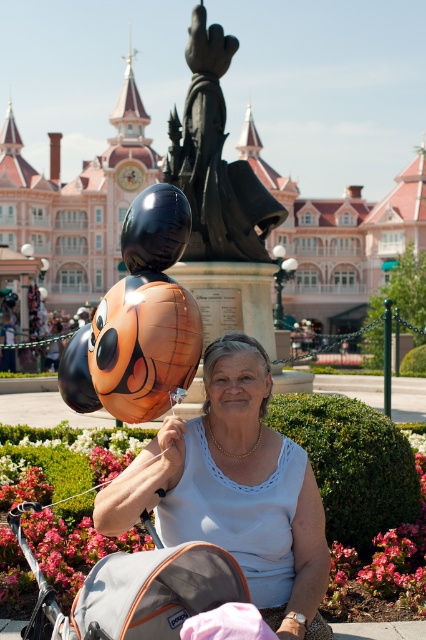
Question: Which object is closer to the camera taking this photo?

Choices:
 (A) black polished statue at center
 (B) white fabric shirt at center

Answer: (B)

Question: Which is farther from the gray fabric baby carriage at lower center?

Choices:
 (A) black polished statue at center
 (B) white fabric shirt at center

Answer: (A)

Question: Does white fabric shirt at center have a lesser width compared to black polished statue at center?

Choices:
 (A) yes
 (B) no

Answer: (B)

Question: Does white fabric shirt at center have a larger size compared to gray fabric baby carriage at lower center?

Choices:
 (A) yes
 (B) no

Answer: (A)

Question: Among these points, which one is farthest from the camera?

Choices:
 (A) (210, 177)
 (B) (232, 588)

Answer: (A)

Question: Can you confirm if white fabric shirt at center is smaller than gray fabric baby carriage at lower center?

Choices:
 (A) yes
 (B) no

Answer: (B)